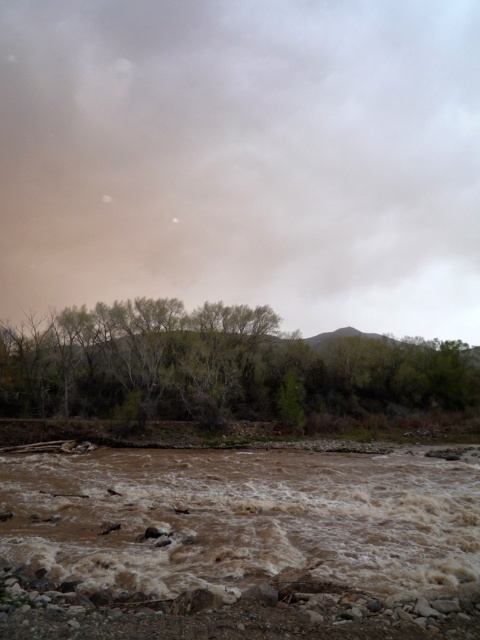
You are standing at the edge of the river and notice the brown muddy water at lower center. Based on the coordinates provided, where exactly is the brown muddy water located in the image?

The brown muddy water at lower center is located at point (242, 516) in the image.

You are a hiker trying to cross the river. You see the brown muddy water at lower center and the green leafy trees at center. Which object is closer to you as you stand on the riverbank?

The brown muddy water at lower center is closer to you because it is in front of the green leafy trees at center.